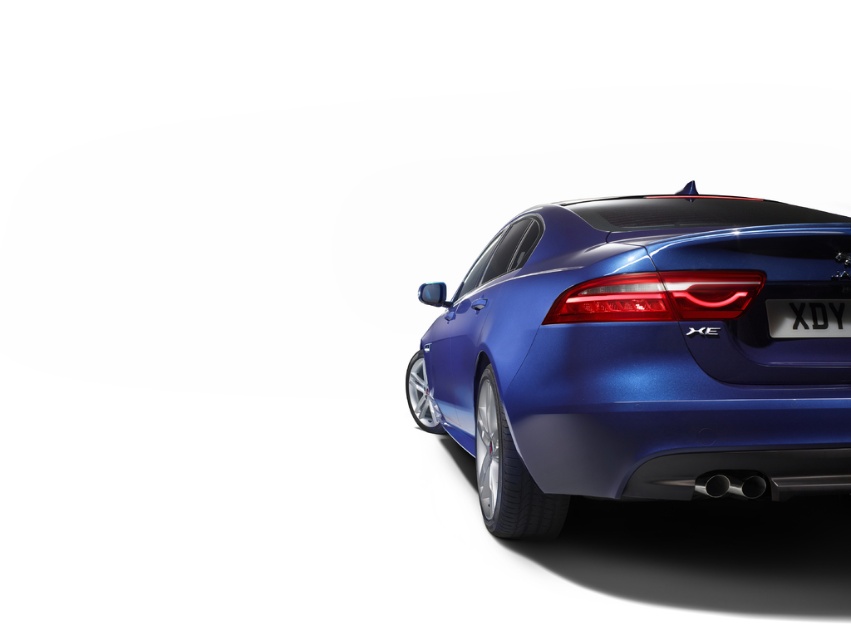
Question: Which of the following is the closest to the observer?

Choices:
 (A) (647, 493)
 (B) (825, 332)

Answer: (B)

Question: Which of the following is the closest to the observer?

Choices:
 (A) glossy metallic car at center
 (B) black plastic license plate at center
 (C) matte red tail light at center

Answer: (A)

Question: Is glossy metallic car at center positioned at the back of matte red tail light at center?

Choices:
 (A) no
 (B) yes

Answer: (A)

Question: Does glossy metallic car at center appear over black plastic license plate at center?

Choices:
 (A) no
 (B) yes

Answer: (B)

Question: Is matte red tail light at center closer to the viewer compared to black plastic license plate at center?

Choices:
 (A) no
 (B) yes

Answer: (A)

Question: Which object appears farthest from the camera in this image?

Choices:
 (A) black plastic license plate at center
 (B) matte red tail light at center

Answer: (B)